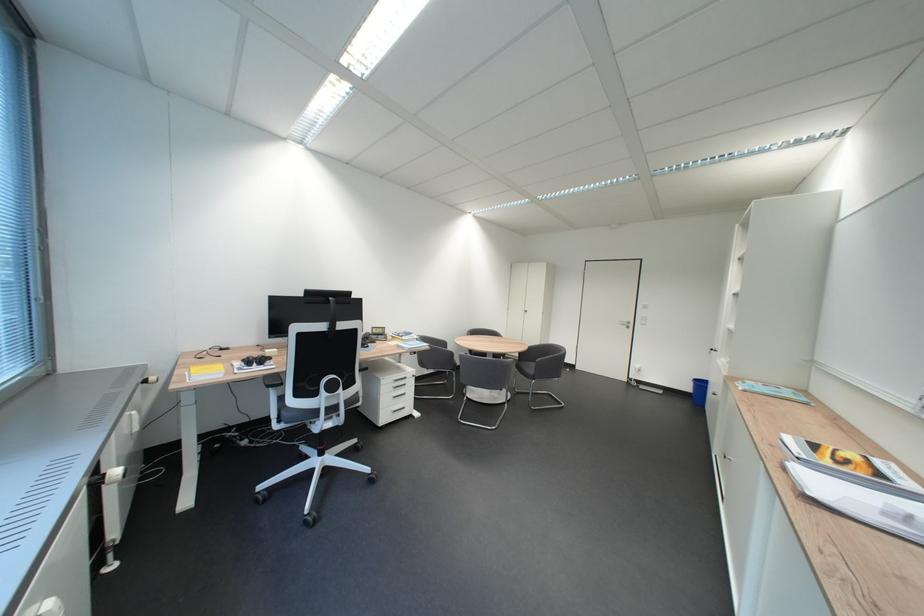
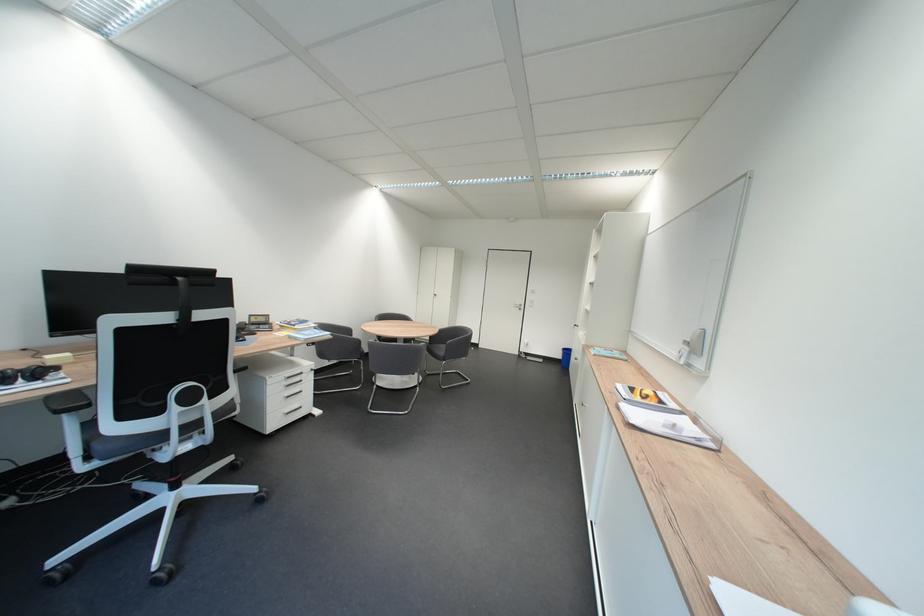
Locate, in the second image, the point that corresponds to the point at 464,355 in the first image.

(371, 342)